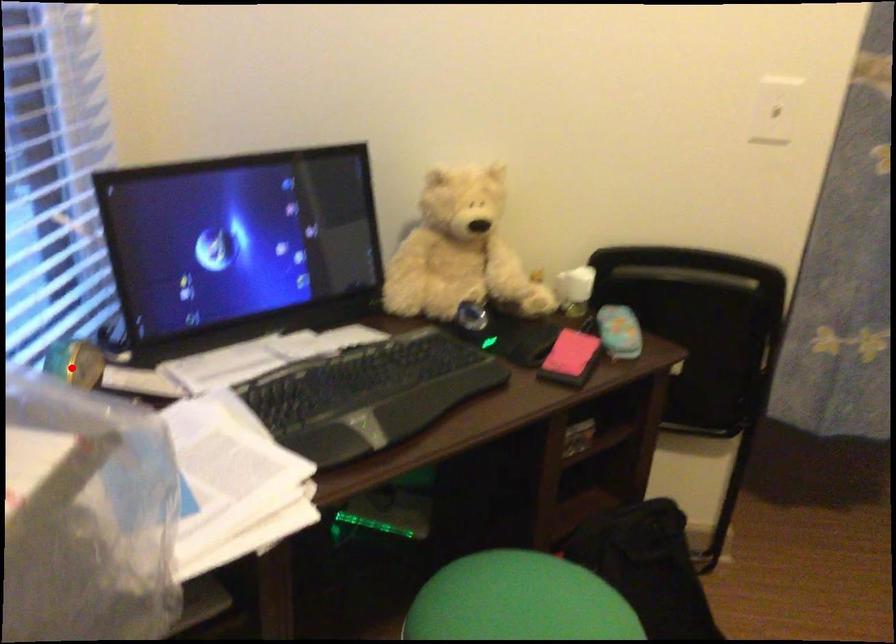
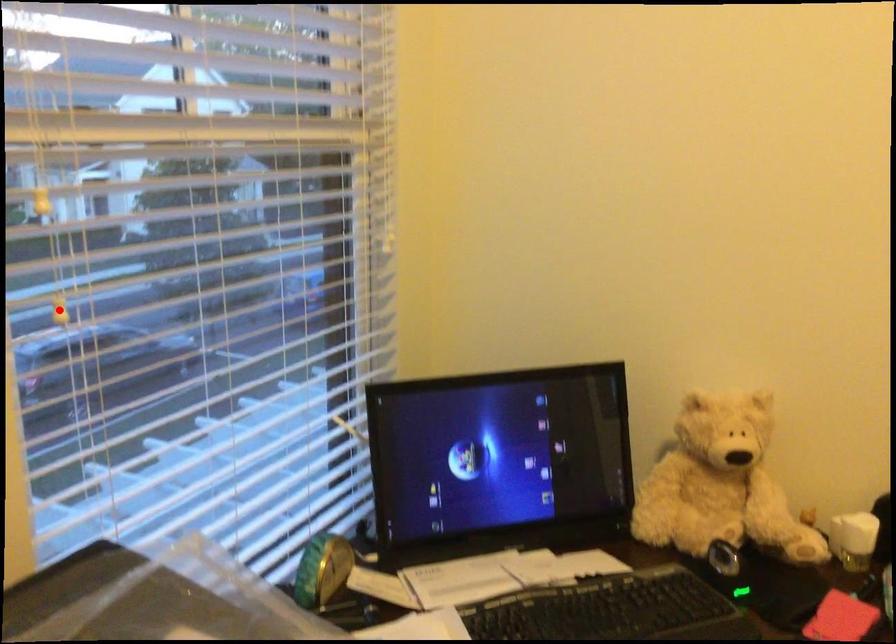
I am providing you with two images of the same scene from different viewpoints. A red point is marked on the first image and another point is marked on the second image. Does the point marked in image1 correspond to the same location as the one in image2?

No